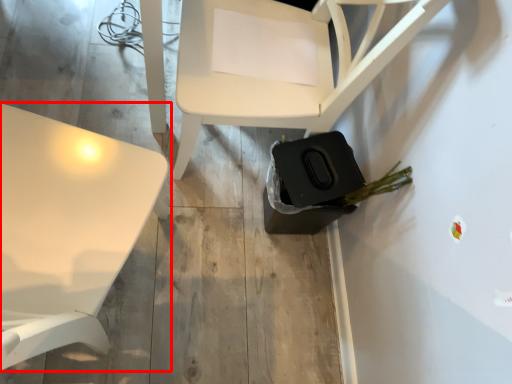
Question: In this image, where is table (annotated by the red box) located relative to chair?

Choices:
 (A) right
 (B) left

Answer: (B)